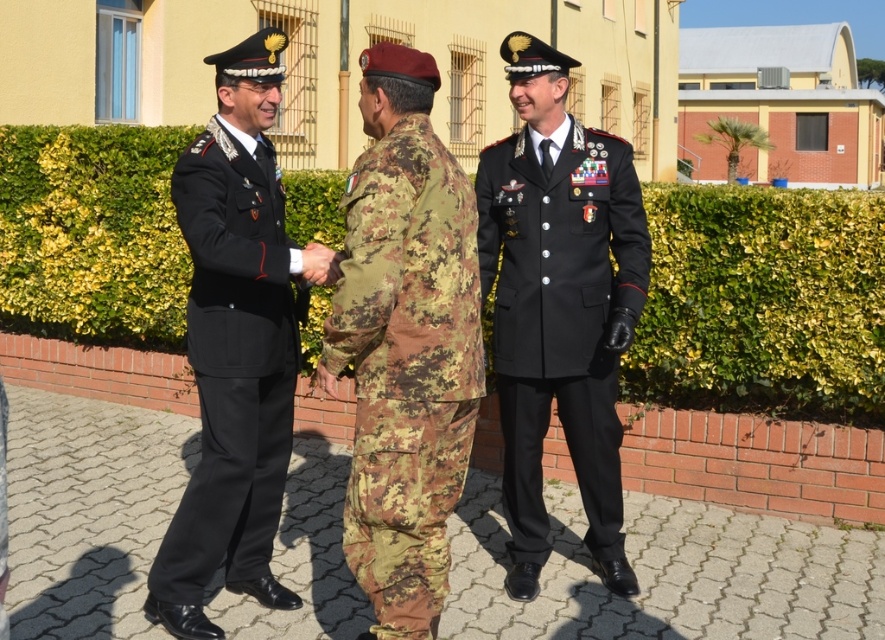
Which is above, green leafy hedge at center or black woolen coat at center?

Positioned higher is black woolen coat at center.

Find the location of `green leafy hedge at center`. green leafy hedge at center is located at coordinates (762, 301).

Who is more forward, (x=691, y=285) or (x=587, y=403)?

Point (x=587, y=403)

Find the location of a particular element. The image size is (885, 640). green leafy hedge at center is located at coordinates (762, 301).

Can you confirm if camouflage fabric uniform at center is taller than black woolen coat at center?

No.

Can you confirm if camouflage fabric uniform at center is smaller than black woolen coat at center?

Yes.

Which is in front, point (363, 289) or point (610, 525)?

Positioned in front is point (363, 289).

Locate an element on the screen. This screenshot has width=885, height=640. camouflage fabric uniform at center is located at coordinates (406, 368).

Does camouflage fabric uniform at center appear on the left side of black woolen uniform at left?

In fact, camouflage fabric uniform at center is to the right of black woolen uniform at left.

Does camouflage fabric uniform at center appear over black woolen uniform at left?

Yes.

Locate an element on the screen. Image resolution: width=885 pixels, height=640 pixels. camouflage fabric uniform at center is located at coordinates (406, 368).